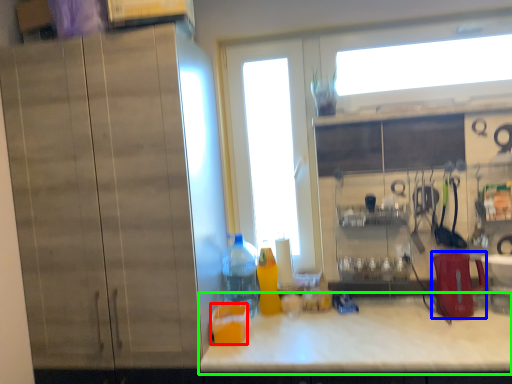
Question: Considering the real-world distances, which object is farthest from juice (highlighted by a red box)? appliance (highlighted by a blue box) or countertop (highlighted by a green box)?

Choices:
 (A) appliance
 (B) countertop

Answer: (A)